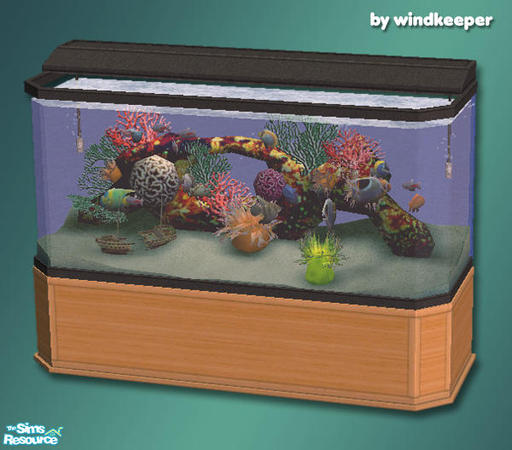
Find the location of `green floor`. green floor is located at coordinates [211, 433].